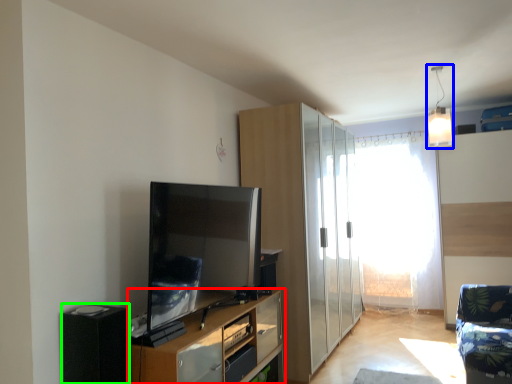
Question: Which object is the closest to the cupboard (highlighted by a red box)? Choose among these: light fixture (highlighted by a blue box) or appliance (highlighted by a green box).

Choices:
 (A) light fixture
 (B) appliance

Answer: (B)